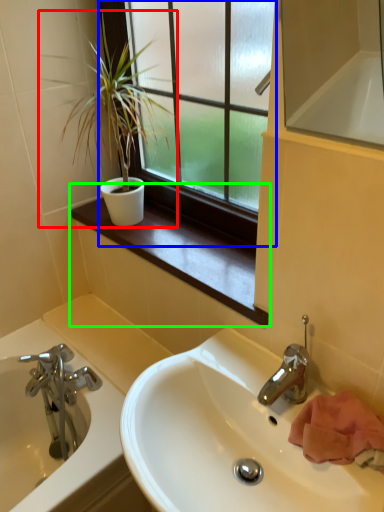
Question: Based on their relative distances, which object is nearer to houseplant (highlighted by a red box)? Choose from window (highlighted by a blue box) and window sill (highlighted by a green box).

Choices:
 (A) window
 (B) window sill

Answer: (A)